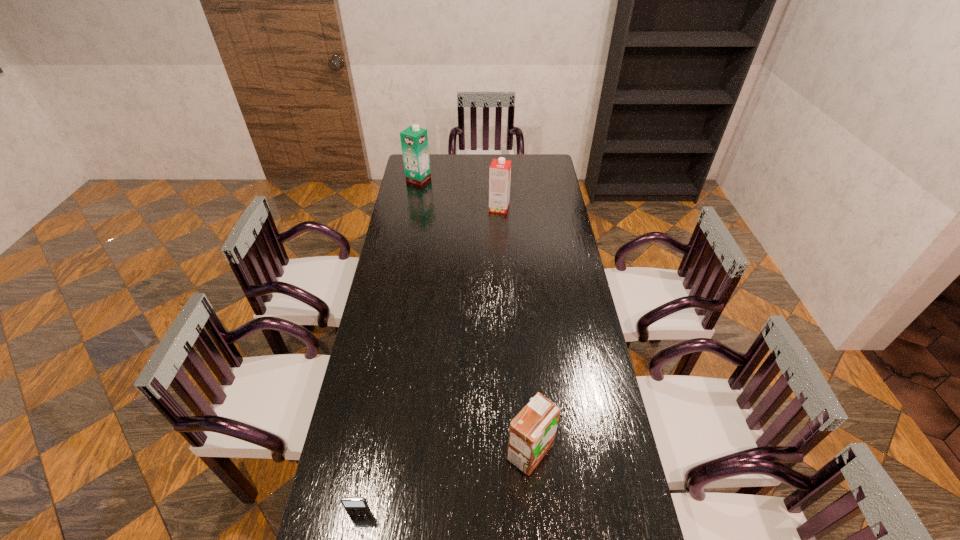
Select which object appears as the third closest to the third nearest object. Please provide its 2D coordinates. Your answer should be formatted as a tuple, i.e. [(x, y)], where the tuple contains the x and y coordinates of a point satisfying the conditions above.

[(353, 505)]

Where is `the third closest object relative to the farthest carton`? This screenshot has width=960, height=540. the third closest object relative to the farthest carton is located at coordinates (353, 505).

Find the location of a particular element. carton that can be found as the second closest to the nearest object is located at coordinates (500, 169).

You are a GUI agent. You are given a task and a screenshot of the screen. Output one action in this format:
    pyautogui.click(x=<x>, y=<y>)
    Task: Click on the carton that is the closest to the second farthest object
    
    Given the screenshot: What is the action you would take?
    pyautogui.click(x=414, y=140)

This screenshot has width=960, height=540. Find the location of `free space that satisfies the following two spatial constraints: 1. on the straw side of the nearest carton; 2. on the front-facing side of the iPod`. free space that satisfies the following two spatial constraints: 1. on the straw side of the nearest carton; 2. on the front-facing side of the iPod is located at coordinates (535, 514).

Locate an element on the screen. The height and width of the screenshot is (540, 960). free region that satisfies the following two spatial constraints: 1. on the straw side of the second nearest object; 2. on the front-facing side of the nearest object is located at coordinates (535, 514).

Locate an element on the screen. free space that satisfies the following two spatial constraints: 1. on the straw side of the third tallest object; 2. on the front-facing side of the iPod is located at coordinates (535, 514).